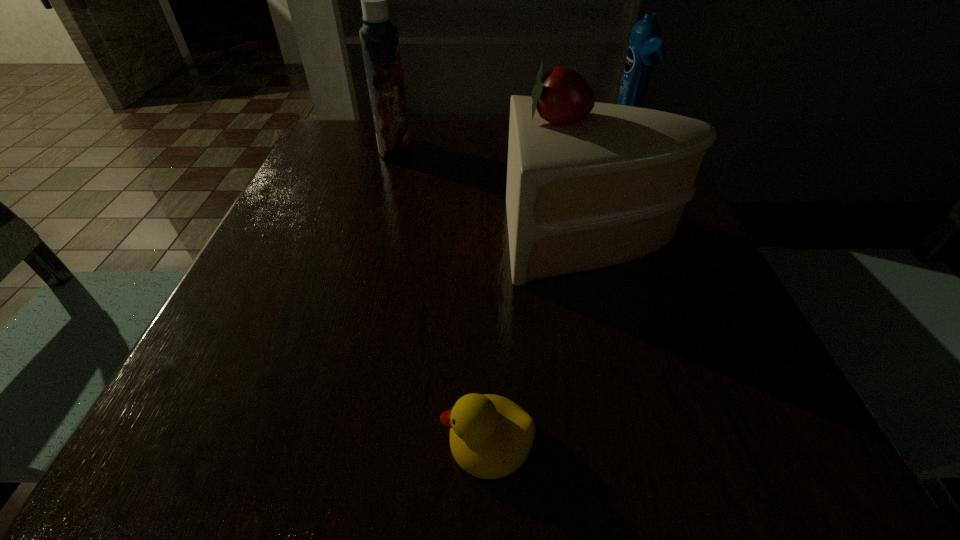
Locate an element on the screen. The image size is (960, 540). the farthest object is located at coordinates (370, 121).

The height and width of the screenshot is (540, 960). In order to click on sunflower in this screenshot , I will do `click(370, 121)`.

Find the location of a particular element. The height and width of the screenshot is (540, 960). the eighth nearest object is located at coordinates (648, 95).

What are the coordinates of `the biggest gold watch` in the screenshot? It's located at [348, 165].

In order to click on the leftmost gray watch in this screenshot , I will do `click(511, 230)`.

The image size is (960, 540). I want to click on the biggest gray watch, so pyautogui.click(x=511, y=230).

Where is `candle holder`? The width and height of the screenshot is (960, 540). candle holder is located at coordinates (329, 238).

Find the location of a particular element. The width and height of the screenshot is (960, 540). the second farthest gray watch is located at coordinates (681, 279).

Where is `the second smallest gray watch`? The width and height of the screenshot is (960, 540). the second smallest gray watch is located at coordinates (681, 279).

Find the location of a particular element. The width and height of the screenshot is (960, 540). the rightmost gold watch is located at coordinates (527, 357).